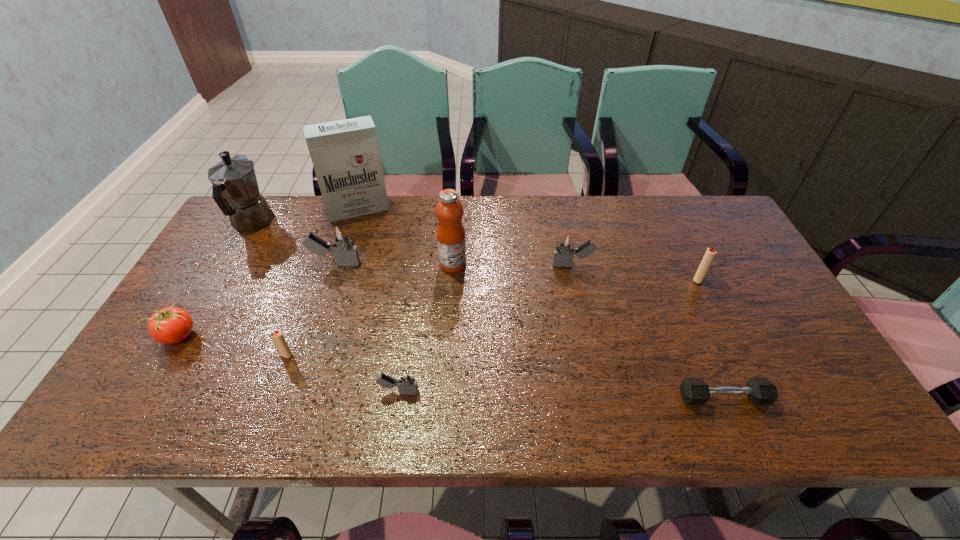
Locate an element on the screen. blank region between the shortest object and the seventh object from left to right is located at coordinates (588, 331).

Where is `vacant space that's between the third nearest igniter and the rightmost gray igniter`? Image resolution: width=960 pixels, height=540 pixels. vacant space that's between the third nearest igniter and the rightmost gray igniter is located at coordinates (636, 272).

Identify the location of free point between the left red igniter and the shortest object. This screenshot has width=960, height=540. (505, 376).

The height and width of the screenshot is (540, 960). Identify the location of free space between the seventh object from left to right and the right red igniter. (576, 272).

This screenshot has width=960, height=540. Identify the location of free space that is in between the third farthest igniter and the red tomato. (439, 308).

Locate an element on the screen. vacant area that lies between the tallest object and the nearer red igniter is located at coordinates (323, 282).

Where is `free spot between the fifth nearest object and the tomato`? This screenshot has height=540, width=960. free spot between the fifth nearest object and the tomato is located at coordinates (439, 308).

Point out which object is positioned as the third nearest to the orange fruit juice. Please provide its 2D coordinates. Your answer should be formatted as a tuple, i.e. [(x, y)], where the tuple contains the x and y coordinates of a point satisfying the conditions above.

[(562, 256)]

The image size is (960, 540). I want to click on object that is the second closest to the tallest object, so click(x=341, y=243).

The height and width of the screenshot is (540, 960). Identify the location of igniter that stands as the fourth closest to the tallest igniter. (709, 256).